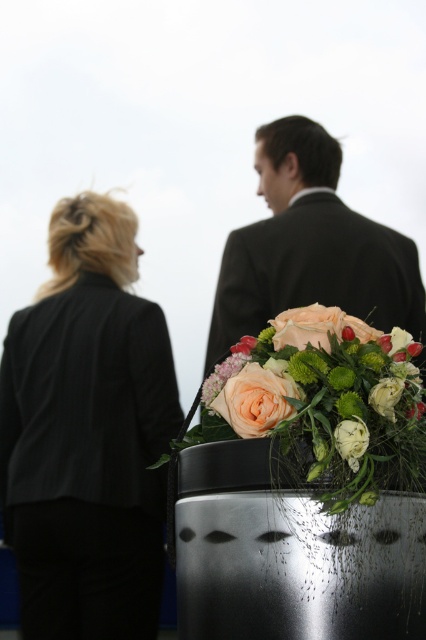
Question: Can you confirm if soft peach rose at center is positioned below white matte flower at center?

Choices:
 (A) yes
 (B) no

Answer: (B)

Question: In this image, where is matte black suit at center located relative to soft peach rose at center?

Choices:
 (A) above
 (B) below

Answer: (A)

Question: Which point is closer to the camera?

Choices:
 (A) (207, 364)
 (B) (253, 369)
 (C) (294, 326)

Answer: (B)

Question: Which of the following is the farthest from the observer?

Choices:
 (A) matte peach rose at center
 (B) white matte flower at center
 (C) black fabric jacket at left

Answer: (C)

Question: Which point is farther from the camera taking this photo?

Choices:
 (A) (17, 493)
 (B) (422, 312)
 (C) (353, 451)

Answer: (B)

Question: From the image, what is the correct spatial relationship of soft peach rose at center in relation to white matte flower at center?

Choices:
 (A) above
 (B) below

Answer: (A)